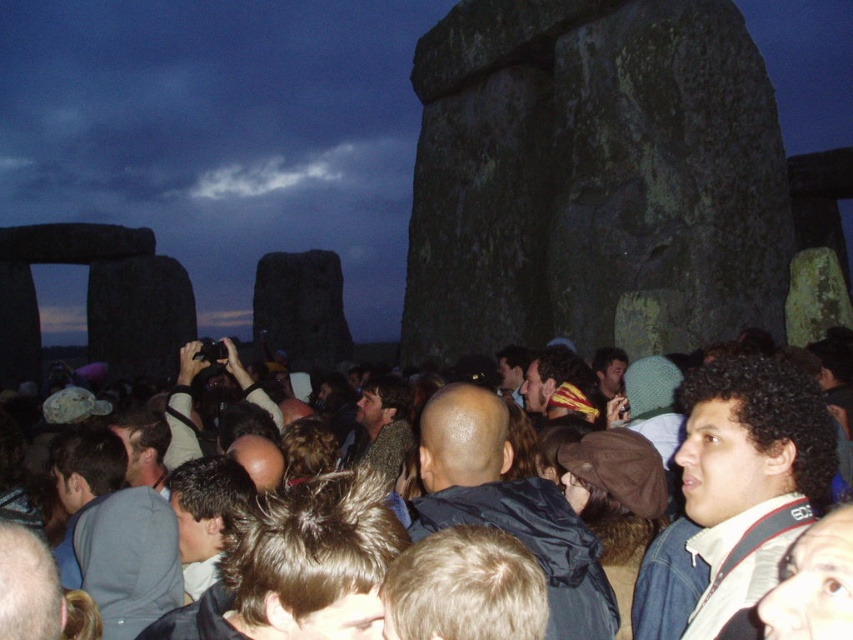
You are standing at the center of Stonehenge and see two points in the image labeled as point (769,234) and point (363,404). Which point is closer to your current position?

Point (769,234) is closer to the camera than point (363,404), so it is closer to your current position.

You are standing in the crowd at Stonehenge during twilight. You notice the dark gray stone at center and the brown fabric crowd at center. Which object is closer to you?

The dark gray stone at center is closer to you than the brown fabric crowd at center.

You are planning to take a photo of the dark gray stone at center and the brown fabric crowd at center at Stonehenge. Considering their sizes in the scene, which one will appear smaller in your photo?

The dark gray stone at center will appear smaller in the photo because it occupies less space than the brown fabric crowd at center.